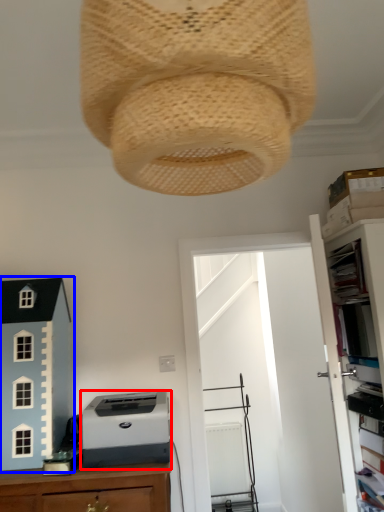
Question: Which point is further to the camera, printer (highlighted by a red box) or toy (highlighted by a blue box)?

Choices:
 (A) printer
 (B) toy

Answer: (B)